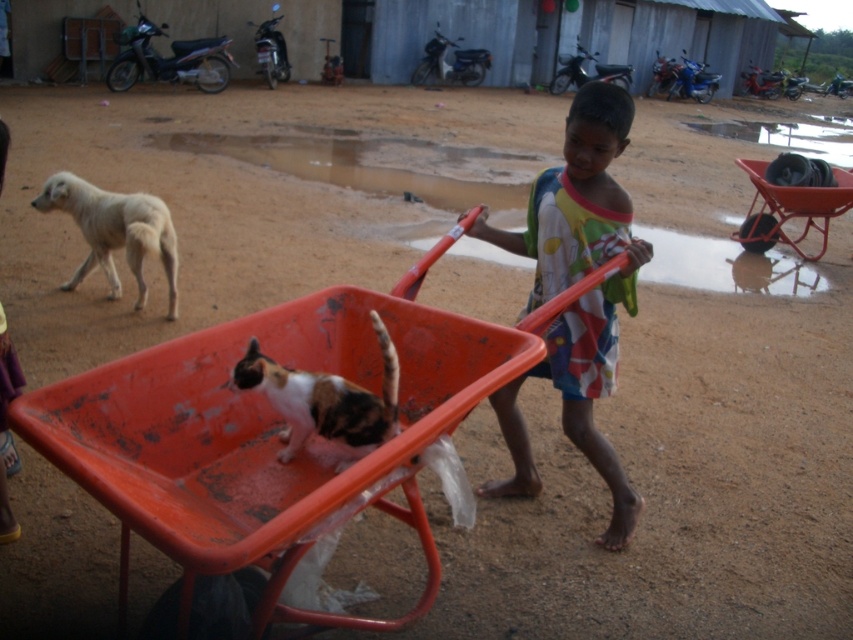
In the scene shown: Which of these two, multicolored fabric shirt at center or calico fur cat at center, stands taller?

With more height is multicolored fabric shirt at center.

Which is above, multicolored fabric shirt at center or calico fur cat at center?

multicolored fabric shirt at center is above.

This screenshot has width=853, height=640. Identify the location of multicolored fabric shirt at center. (579, 298).

Who is more distant from viewer, (288, 532) or (631, 492)?

The point (631, 492) is more distant.

Can you confirm if orange plastic cart at center is wider than multicolored fabric shirt at center?

Yes, orange plastic cart at center is wider than multicolored fabric shirt at center.

Between point (206, 472) and point (494, 240), which one is positioned in front?

Positioned in front is point (206, 472).

Identify the location of orange plastic cart at center. The width and height of the screenshot is (853, 640). (271, 433).

Describe the element at coordinates (579, 298) in the screenshot. I see `multicolored fabric shirt at center` at that location.

In the scene shown: Between multicolored fabric shirt at center and white fur dog at left, which one appears on the left side from the viewer's perspective?

Positioned to the left is white fur dog at left.

Locate an element on the screen. multicolored fabric shirt at center is located at coordinates (579, 298).